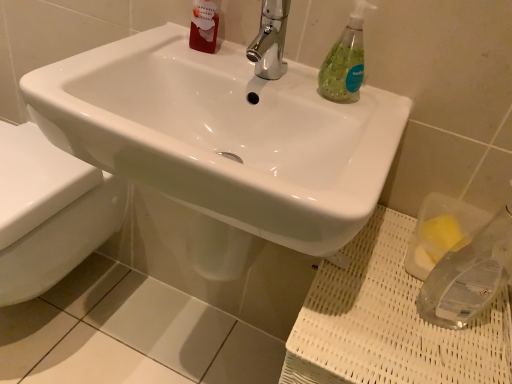
Locate an element on the screen. The image size is (512, 384). free spot in front of green translucent soap dispenser at upper right is located at coordinates (358, 128).